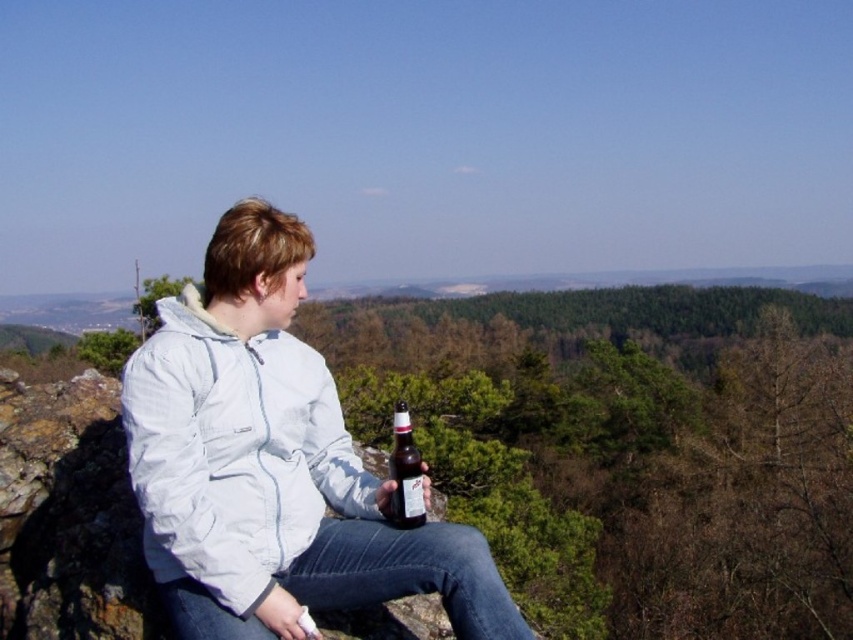
Is point (236, 392) positioned after point (415, 444)?

No, it is not.

Is white fleece jacket at center shorter than brown glass bottle at center?

Indeed, white fleece jacket at center has a lesser height compared to brown glass bottle at center.

Locate an element on the screen. white fleece jacket at center is located at coordinates (233, 452).

Measure the distance between white matte jacket at center and white fleece jacket at center.

They are 34.55 centimeters apart.

This screenshot has height=640, width=853. What do you see at coordinates (271, 464) in the screenshot?
I see `white matte jacket at center` at bounding box center [271, 464].

Image resolution: width=853 pixels, height=640 pixels. What do you see at coordinates (271, 464) in the screenshot?
I see `white matte jacket at center` at bounding box center [271, 464].

At what (x,y) coordinates should I click in order to perform the action: click on white matte jacket at center. Please return your answer as a coordinate pair (x, y). Looking at the image, I should click on (271, 464).

Is point (219, 524) farther from viewer compared to point (409, 516)?

No.

Describe the element at coordinates (271, 464) in the screenshot. I see `white matte jacket at center` at that location.

Where is `white matte jacket at center`? The width and height of the screenshot is (853, 640). white matte jacket at center is located at coordinates (271, 464).